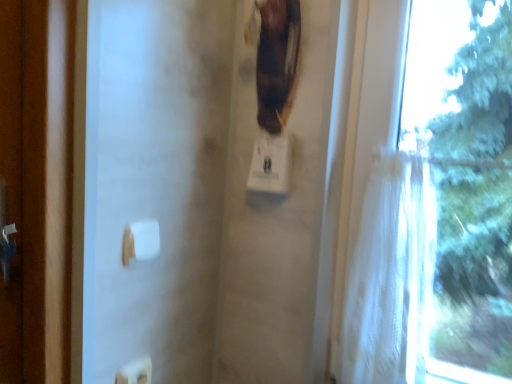
Question: Is white sheer curtain at right not close to white plastic towel bar at lower center?

Choices:
 (A) no
 (B) yes

Answer: (A)

Question: Is white sheer curtain at right placed right next to white plastic towel bar at lower center?

Choices:
 (A) no
 (B) yes

Answer: (A)

Question: Is white sheer curtain at right positioned beyond the bounds of white plastic towel bar at lower center?

Choices:
 (A) yes
 (B) no

Answer: (A)

Question: From a real-world perspective, is white sheer curtain at right positioned over white plastic towel bar at lower center based on gravity?

Choices:
 (A) no
 (B) yes

Answer: (B)

Question: Can white plastic towel bar at lower center be found inside white sheer curtain at right?

Choices:
 (A) yes
 (B) no

Answer: (B)

Question: From their relative heights in the image, would you say white sheer fabric at right is taller or shorter than brown leather guitar at upper center?

Choices:
 (A) tall
 (B) short

Answer: (A)

Question: In the image, is white sheer fabric at right on the left side or the right side of brown leather guitar at upper center?

Choices:
 (A) right
 (B) left

Answer: (A)

Question: Is point (400, 235) closer or farther from the camera than point (262, 72)?

Choices:
 (A) farther
 (B) closer

Answer: (B)

Question: From the image's perspective, is white sheer fabric at right located above or below brown leather guitar at upper center?

Choices:
 (A) above
 (B) below

Answer: (B)

Question: Considering the relative positions of white sheer curtain at right and white plastic light switch at lower center in the image provided, is white sheer curtain at right to the left or to the right of white plastic light switch at lower center?

Choices:
 (A) right
 (B) left

Answer: (A)

Question: Does point (394, 168) appear closer or farther from the camera than point (148, 380)?

Choices:
 (A) closer
 (B) farther

Answer: (B)

Question: From the image's perspective, is white sheer curtain at right above or below white plastic light switch at lower center?

Choices:
 (A) below
 (B) above

Answer: (B)

Question: Is white sheer curtain at right inside or outside of white plastic light switch at lower center?

Choices:
 (A) outside
 (B) inside

Answer: (A)

Question: From a real-world perspective, relative to white sheer fabric at right, is white plastic light switch at lower center vertically above or below?

Choices:
 (A) above
 (B) below

Answer: (B)

Question: Is white plastic light switch at lower center situated inside white sheer fabric at right or outside?

Choices:
 (A) outside
 (B) inside

Answer: (A)